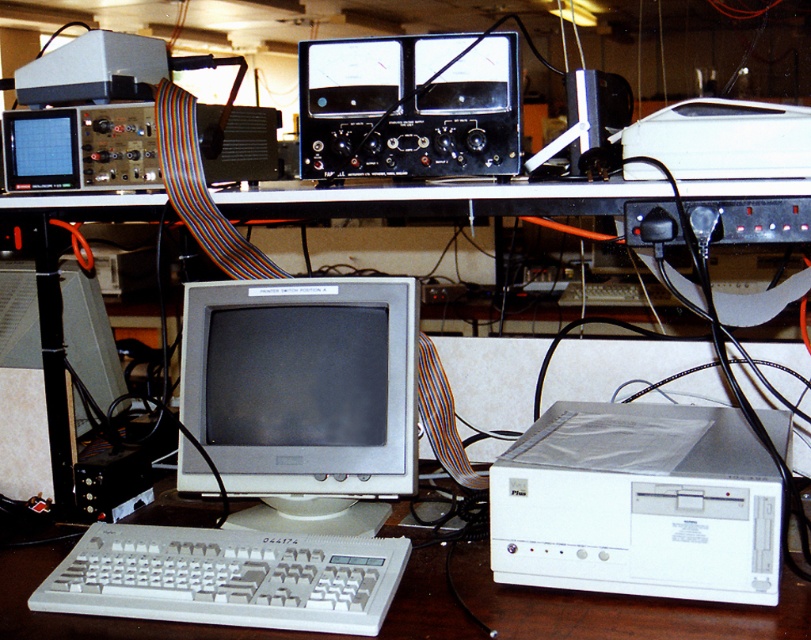
You are a technician needing to connect the matte gray monitor at center to the white plastic computer at lower right. Given that the required cable is 15 inches long, will it be sufficient to reach between the two devices?

The distance between the matte gray monitor at center and the white plastic computer at lower right is 14.88 inches. Since the cable is 15 inches long, it will be sufficient to connect them.

You are setting up a desk and want to place the matte gray monitor at center and the white plastic computer at lower right. Considering their heights, which item should be placed on a higher shelf to accommodate its size?

The matte gray monitor at center is much taller than the white plastic computer at lower right, so it should be placed on a higher shelf to accommodate its size.